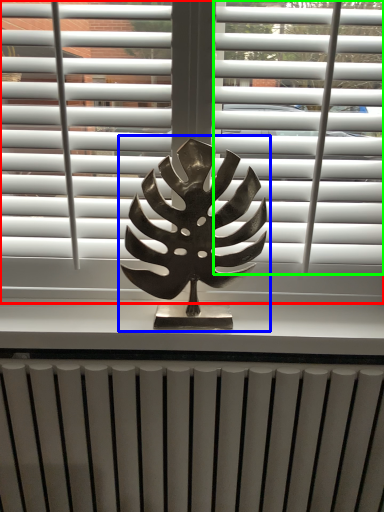
Question: Estimate the real-world distances between objects in this image. Which object is farther from window blind (highlighted by a red box), bronze statue (highlighted by a blue box) or blind (highlighted by a green box)?

Choices:
 (A) bronze statue
 (B) blind

Answer: (A)